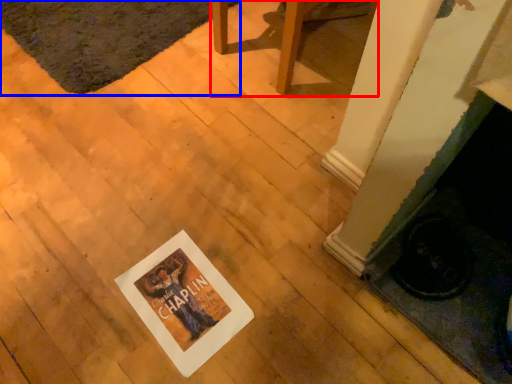
Question: Among these objects, which one is nearest to the camera, furniture (highlighted by a red box) or mat (highlighted by a blue box)?

Choices:
 (A) furniture
 (B) mat

Answer: (A)